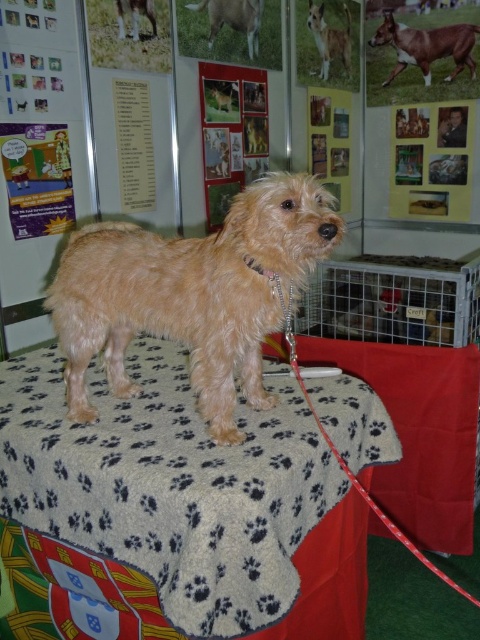
Who is positioned more to the left, gray paw print fabric at center or wooden frame at upper center?

gray paw print fabric at center is more to the left.

The height and width of the screenshot is (640, 480). Find the location of `gray paw print fabric at center`. gray paw print fabric at center is located at coordinates (169, 486).

Is fuzzy brown dog at center taller than wooden frame at upper right?

No.

Between fuzzy brown dog at center and wooden frame at upper right, which one is positioned lower?

fuzzy brown dog at center is below.

You are a GUI agent. You are given a task and a screenshot of the screen. Output one action in this format:
    pyautogui.click(x=<x>, y=<y>)
    Task: Click on the fuzzy brown dog at center
    
    Given the screenshot: What is the action you would take?
    pyautogui.click(x=192, y=292)

Who is positioned more to the right, light brown fur at upper right or shiny brown dog at center?

light brown fur at upper right is more to the right.

Does light brown fur at upper right appear under shiny brown dog at center?

Actually, light brown fur at upper right is above shiny brown dog at center.

Is point (346, 42) closer to camera compared to point (120, 19)?

No, it is not.

Image resolution: width=480 pixels, height=640 pixels. Find the location of `light brown fur at upper right`. light brown fur at upper right is located at coordinates (330, 38).